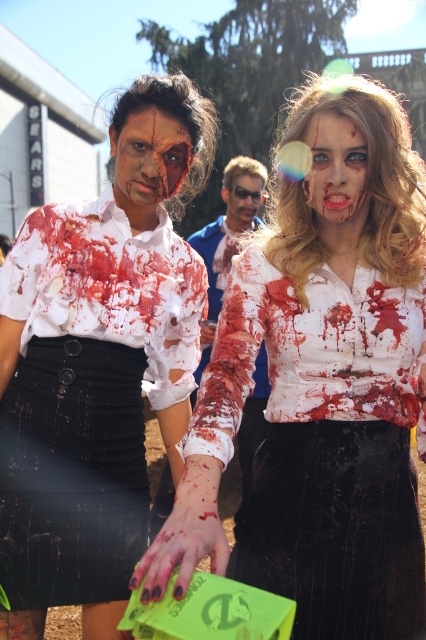
Can you confirm if ripped white shirt at center is positioned to the right of blood-stained makeup at center?

In fact, ripped white shirt at center is to the left of blood-stained makeup at center.

Is ripped white shirt at center above blood-stained makeup at center?

No.

This screenshot has height=640, width=426. What are the coordinates of `ripped white shirt at center` in the screenshot? It's located at (88, 394).

Between point (132, 154) and point (229, 205), which one is positioned behind?

Point (229, 205)

Image resolution: width=426 pixels, height=640 pixels. Identify the location of matte white face at center. (149, 157).

Is point (388, 349) more distant than point (118, 168)?

No, it is in front of (118, 168).

Is matte white blouse at center to the right of matte white face at center from the viewer's perspective?

Indeed, matte white blouse at center is positioned on the right side of matte white face at center.

Which is behind, point (365, 634) or point (137, 204)?

Positioned behind is point (137, 204).

Identify the location of matte white blouse at center. (319, 400).